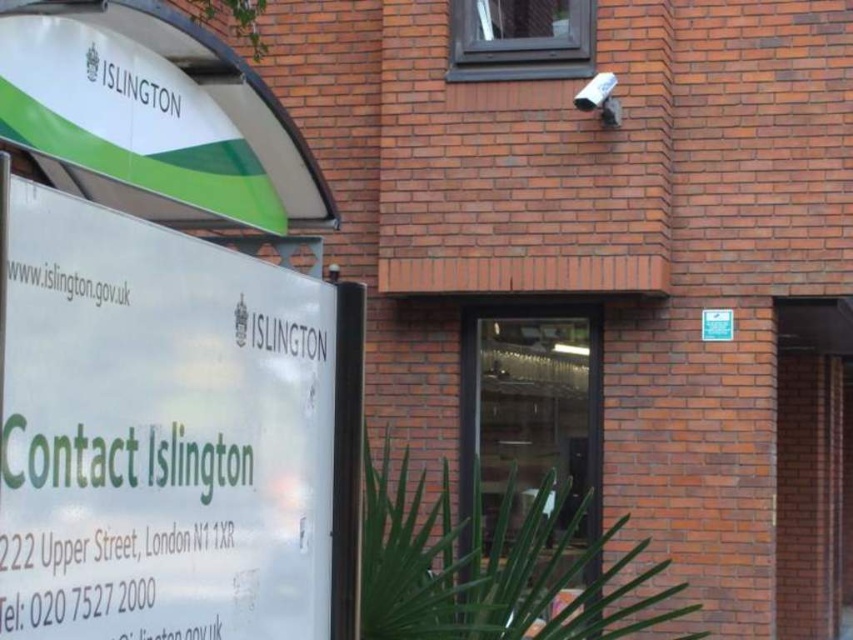
Question: Can you confirm if white paper sign at left is positioned to the right of transparent glass door at center?

Choices:
 (A) yes
 (B) no

Answer: (B)

Question: Which point appears farthest from the camera in this image?

Choices:
 (A) (0, 560)
 (B) (572, 490)

Answer: (B)

Question: Which point is farther from the camera taking this photo?

Choices:
 (A) (527, 465)
 (B) (9, 604)

Answer: (A)

Question: Does white paper sign at left lie in front of transparent glass door at center?

Choices:
 (A) no
 (B) yes

Answer: (B)

Question: Does white paper sign at left appear on the left side of transparent glass door at center?

Choices:
 (A) no
 (B) yes

Answer: (B)